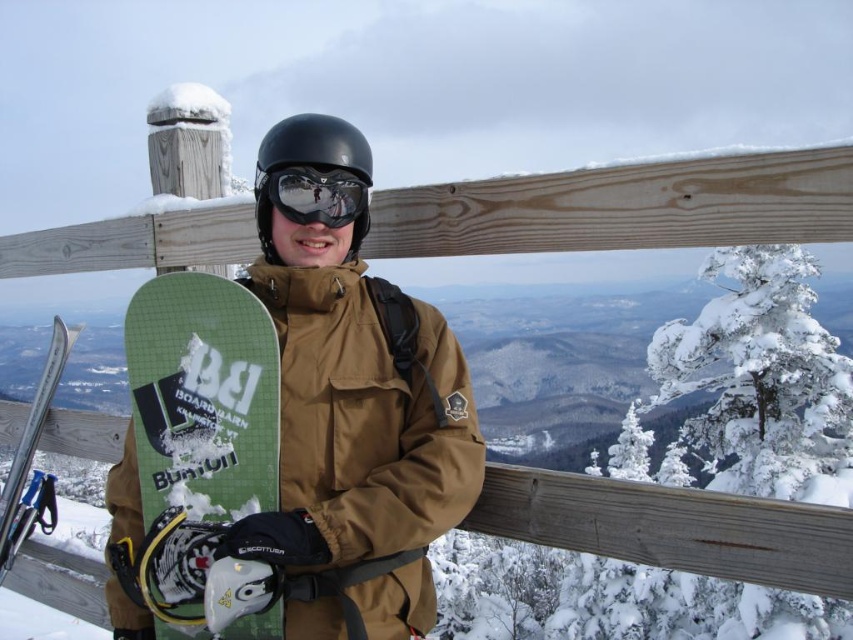
Question: Based on their relative distances, which object is nearer to the green matte snowboard at lower left?

Choices:
 (A) glossy reflective goggles at center
 (B) matte brown snowboard at center
 (C) black matte helmet at center

Answer: (B)

Question: Does black matte helmet at center appear on the right side of glossy reflective goggles at center?

Choices:
 (A) no
 (B) yes

Answer: (A)

Question: Which point is farther to the camera?

Choices:
 (A) green matte snowboard at lower left
 (B) matte brown snowboard at center

Answer: (A)

Question: Which is nearer to the black matte helmet at center?

Choices:
 (A) matte brown snowboard at center
 (B) green matte snowboard at lower left
 (C) glossy reflective goggles at center

Answer: (C)

Question: Can you confirm if green matte snowboard at lower left is positioned above glossy reflective goggles at center?

Choices:
 (A) yes
 (B) no

Answer: (B)

Question: Considering the relative positions of green matte snowboard at lower left and glossy reflective goggles at center in the image provided, where is green matte snowboard at lower left located with respect to glossy reflective goggles at center?

Choices:
 (A) above
 (B) below

Answer: (B)